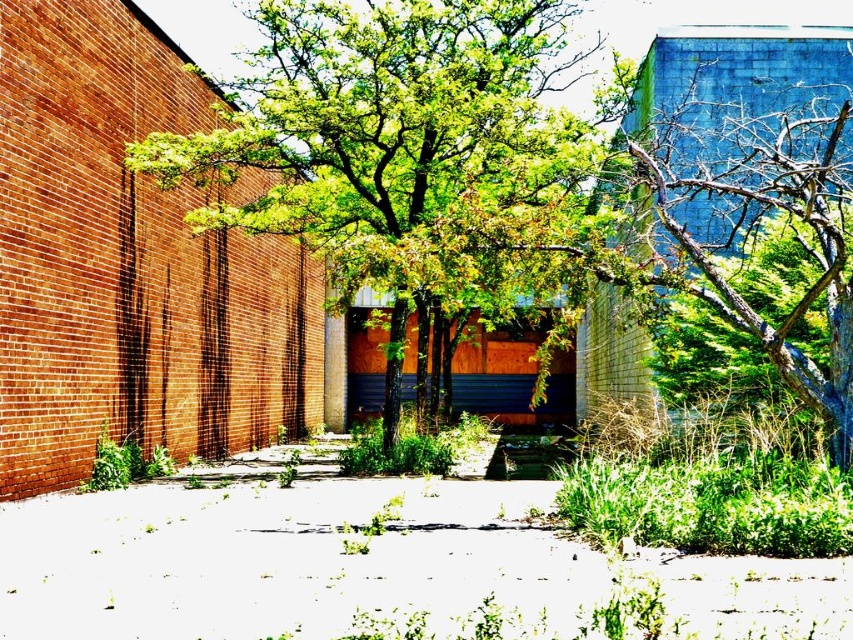
Question: Can you confirm if green leafy tree at center is smaller than white gravel at center?

Choices:
 (A) no
 (B) yes

Answer: (A)

Question: Is green leafy tree at center below white gravel at center?

Choices:
 (A) no
 (B) yes

Answer: (A)

Question: Among these objects, which one is farthest from the camera?

Choices:
 (A) white gravel at center
 (B) green leafy tree at center

Answer: (B)

Question: Does green leafy tree at center lie in front of white gravel at center?

Choices:
 (A) yes
 (B) no

Answer: (B)